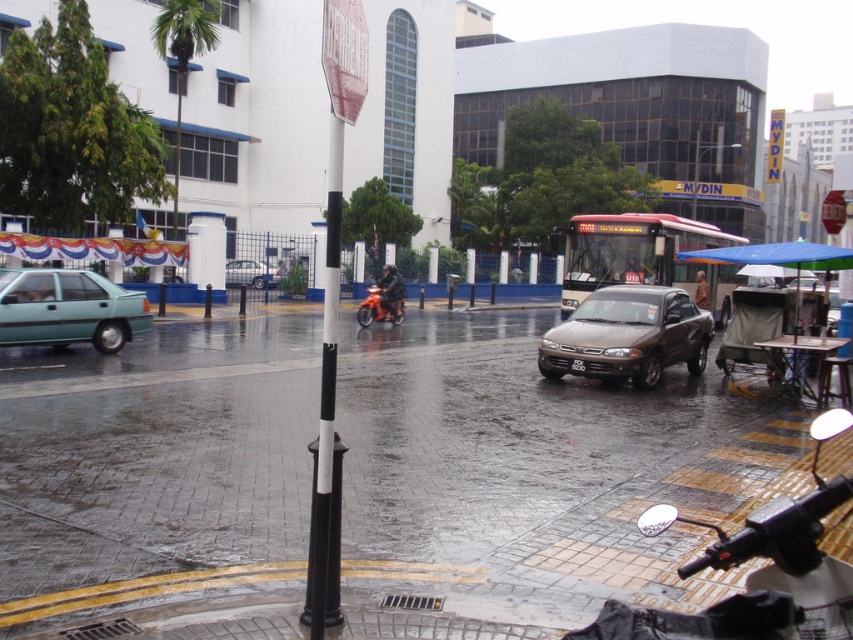
Who is lower down, teal matte sedan at left or orange matte motorcycle at center?

teal matte sedan at left is below.

Can you confirm if teal matte sedan at left is shorter than orange matte motorcycle at center?

Yes.

Locate an element on the screen. teal matte sedan at left is located at coordinates (68, 308).

Where is `teal matte sedan at left`? teal matte sedan at left is located at coordinates (68, 308).

Is satin brown sedan at center bigger than orange matte motorcycle at center?

No.

Does point (668, 291) lie behind point (392, 320)?

No, it is not.

Where is `satin brown sedan at center`? satin brown sedan at center is located at coordinates (627, 337).

Does teal matte sedan at left have a larger size compared to metallic silver car at center?

Correct, teal matte sedan at left is larger in size than metallic silver car at center.

This screenshot has width=853, height=640. What are the coordinates of `teal matte sedan at left` in the screenshot? It's located at (68, 308).

I want to click on teal matte sedan at left, so click(68, 308).